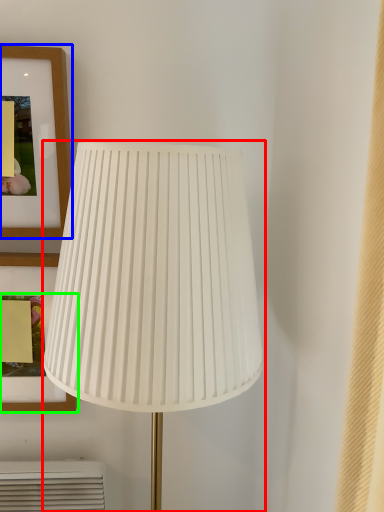
Question: Considering the real-world distances, which object is farthest from lamp (highlighted by a red box)? picture frame (highlighted by a blue box) or picture frame (highlighted by a green box)?

Choices:
 (A) picture frame
 (B) picture frame

Answer: (B)